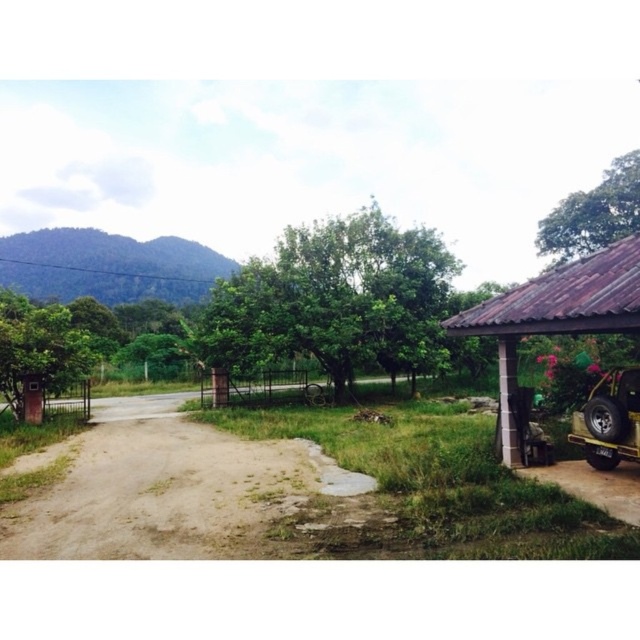
Is brown corrugated roof at right further to camera compared to metallic yellow jeep at lower right?

No, it is not.

The image size is (640, 640). What do you see at coordinates (556, 312) in the screenshot?
I see `brown corrugated roof at right` at bounding box center [556, 312].

Locate an element on the screen. Image resolution: width=640 pixels, height=640 pixels. brown corrugated roof at right is located at coordinates (556, 312).

Can you confirm if green leafy tree at upper right is positioned to the left of metallic yellow jeep at lower right?

No, green leafy tree at upper right is not to the left of metallic yellow jeep at lower right.

Is green leafy tree at upper right positioned in front of metallic yellow jeep at lower right?

That is False.

Is point (608, 227) in front of point (589, 416)?

No, (608, 227) is further to viewer.

Find the location of a particular element. The width and height of the screenshot is (640, 640). green leafy tree at upper right is located at coordinates (593, 212).

Measure the distance from green leafy tree at left to green leafy tree at upper right.

They are 30.38 meters apart.

Is point (6, 342) positioned after point (632, 220)?

No, (6, 342) is in front of (632, 220).

Where is `green leafy tree at left`? Image resolution: width=640 pixels, height=640 pixels. green leafy tree at left is located at coordinates (38, 355).